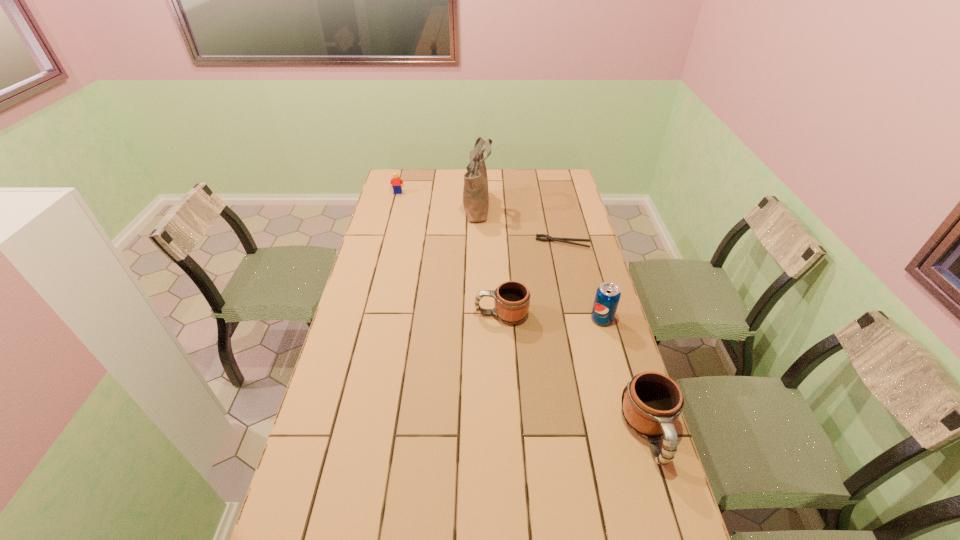
I want to click on free point located 0.170m on the side of the farther mug with the handle, so click(x=425, y=314).

Locate an element on the screen. This screenshot has height=540, width=960. vacant region located 0.200m on the side of the farther mug with the handle is located at coordinates (417, 314).

The image size is (960, 540). Identify the location of free space located 0.050m on the side of the nearest object with the handle. (667, 493).

What are the coordinates of `vacant area situated 0.150m on the front-facing side of the tallest object` in the screenshot? It's located at (524, 206).

Locate an element on the screen. The width and height of the screenshot is (960, 540). blank area located 0.190m on the face of the Lego is located at coordinates (392, 217).

This screenshot has height=540, width=960. Find the location of `vacant space located on the front of the tongs`. vacant space located on the front of the tongs is located at coordinates (566, 258).

Identify the location of vacant space located 0.360m on the front of the pop soda. The width and height of the screenshot is (960, 540). (632, 425).

You are a GUI agent. You are given a task and a screenshot of the screen. Output one action in this format:
    pyautogui.click(x=<x>, y=<y>)
    Task: Click on the shoulder bag located at the far edge
    This screenshot has width=960, height=540.
    Given the screenshot: What is the action you would take?
    pyautogui.click(x=475, y=192)

Where is `Lego at the far edge`? The height and width of the screenshot is (540, 960). Lego at the far edge is located at coordinates (396, 181).

Where is `object located at the left edge`? object located at the left edge is located at coordinates (396, 181).